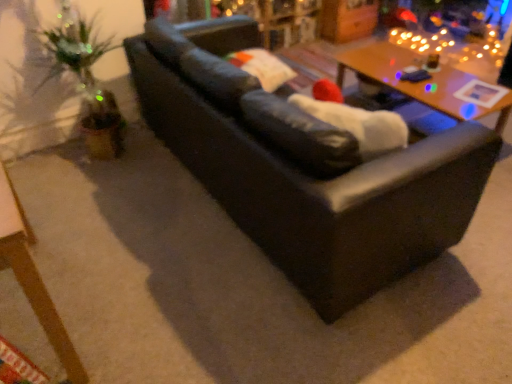
At what (x,y) coordinates should I click in order to perform the action: click on wooden table at upper right, arranged as the first table when viewed from the right. Please return your answer as a coordinate pair (x, y). This screenshot has width=512, height=384. Looking at the image, I should click on (420, 82).

In order to face wooden table at upper right, which is the first table from back to front, should I rotate leftwards or rightwards?

To face it directly, rotate right by 20.216 degrees.

What do you see at coordinates (304, 168) in the screenshot?
I see `matte black couch at center` at bounding box center [304, 168].

Find the location of a particular element. wooden table at lower left, the first table in the left-to-right sequence is located at coordinates (33, 277).

Considering the sizes of objects matte black couch at center and wooden table at upper right, which is the first table from back to front, in the image provided, who is smaller, matte black couch at center or wooden table at upper right, which is the first table from back to front,?

wooden table at upper right, which is the first table from back to front, is smaller.

Between matte black couch at center and wooden table at upper right, arranged as the first table when viewed from the right, which one appears on the left side from the viewer's perspective?

matte black couch at center.

Which of these two, matte black couch at center or wooden table at upper right, arranged as the first table when viewed from the right, stands taller?

matte black couch at center.

Which of these two, matte black couch at center or wooden table at upper right, which is the first table from back to front, is wider?

matte black couch at center.

Based on the photo, could wooden table at lower left, the 2th table in the right-to-left sequence, be considered to be inside matte black couch at center?

No, wooden table at lower left, the 2th table in the right-to-left sequence, is not a part of matte black couch at center.

Measure the distance between matte black couch at center and wooden table at lower left, the 2th table in the right-to-left sequence.

matte black couch at center and wooden table at lower left, the 2th table in the right-to-left sequence, are 1.01 meters apart from each other.

Are matte black couch at center and wooden table at lower left, the 2th table in the right-to-left sequence, beside each other?

There is a gap between matte black couch at center and wooden table at lower left, the 2th table in the right-to-left sequence.

Does point (441, 159) come farther from viewer compared to point (23, 232)?

Yes, it is behind point (23, 232).

Does point (397, 64) lie behind point (26, 264)?

Yes.

Is wooden table at upper right, arranged as the first table when viewed from the right, shorter than wooden table at lower left, the 1th table positioned from the front?

Correct, wooden table at upper right, arranged as the first table when viewed from the right, is not as tall as wooden table at lower left, the 1th table positioned from the front.

Is the position of wooden table at upper right, which is the first table from back to front, more distant than that of wooden table at lower left, the first table in the left-to-right sequence?

Yes, wooden table at upper right, which is the first table from back to front, is further from the camera.

In the scene shown: Which of these two, wooden table at upper right, acting as the second table starting from the left, or wooden table at lower left, the 1th table positioned from the front, is smaller?

With smaller size is wooden table at lower left, the 1th table positioned from the front.

Could matte black couch at center be considered to be inside wooden table at upper right, acting as the second table starting from the left?

No.

From a real-world perspective, which object rests below the other?

wooden table at upper right, acting as the second table starting from the left, from a real-world perspective.

From the image's perspective, is wooden table at upper right, which is the first table from back to front, above or below matte black couch at center?

From the image's perspective, wooden table at upper right, which is the first table from back to front, appears above matte black couch at center.

Does point (352, 58) appear closer or farther from the camera than point (445, 196)?

Point (352, 58) appears to be farther away from the viewer than point (445, 196).

From a real-world perspective, which is physically below, wooden table at lower left, the first table in the left-to-right sequence, or matte black couch at center?

wooden table at lower left, the first table in the left-to-right sequence, is physically lower.

From the image's perspective, which one is positioned lower, wooden table at lower left, the 1th table positioned from the front, or matte black couch at center?

wooden table at lower left, the 1th table positioned from the front.

Does wooden table at lower left, the 1th table positioned from the front, lie behind matte black couch at center?

That is False.

Considering the relative sizes of wooden table at lower left, the first table in the left-to-right sequence, and wooden table at upper right, arranged as the first table when viewed from the right, in the image provided, is wooden table at lower left, the first table in the left-to-right sequence, smaller than wooden table at upper right, arranged as the first table when viewed from the right,?

Yes, wooden table at lower left, the first table in the left-to-right sequence, is smaller than wooden table at upper right, arranged as the first table when viewed from the right.

Is wooden table at lower left, the 1th table positioned from the front, positioned far away from wooden table at upper right, arranged as the first table when viewed from the right?

wooden table at lower left, the 1th table positioned from the front, is far away from wooden table at upper right, arranged as the first table when viewed from the right.

How much distance is there between wooden table at lower left, the 2th table in the right-to-left sequence, and wooden table at upper right, which is the second table from front to back?

A distance of 2.24 meters exists between wooden table at lower left, the 2th table in the right-to-left sequence, and wooden table at upper right, which is the second table from front to back.

Between wooden table at lower left, acting as the second table starting from the back, and wooden table at upper right, which is the first table from back to front, which one has smaller width?

With smaller width is wooden table at lower left, acting as the second table starting from the back.

Find the location of a particular element. Image resolution: width=512 pixels, height=384 pixels. studio couch located in front of the wooden table at upper right, which is the second table from front to back is located at coordinates pyautogui.click(x=304, y=168).

At what (x,y) coordinates should I click in order to perform the action: click on studio couch that is behind the wooden table at lower left, the 1th table positioned from the front. Please return your answer as a coordinate pair (x, y). Looking at the image, I should click on (304, 168).

Based on the photo, considering their positions, is wooden table at upper right, which is the second table from front to back, positioned closer to wooden table at lower left, the first table in the left-to-right sequence, than matte black couch at center?

Among the two, matte black couch at center is located nearer to wooden table at lower left, the first table in the left-to-right sequence.

Estimate the real-world distances between objects in this image. Which object is further from matte black couch at center, wooden table at upper right, acting as the second table starting from the left, or wooden table at lower left, the 1th table positioned from the front?

wooden table at upper right, acting as the second table starting from the left, is positioned further to the anchor matte black couch at center.

Considering their positions, is matte black couch at center positioned further to wooden table at lower left, the first table in the left-to-right sequence, than wooden table at upper right, which is the second table from front to back?

wooden table at upper right, which is the second table from front to back, lies further to wooden table at lower left, the first table in the left-to-right sequence, than the other object.

Considering their positions, is wooden table at lower left, the first table in the left-to-right sequence, positioned closer to matte black couch at center than wooden table at upper right, which is the first table from back to front?

wooden table at lower left, the first table in the left-to-right sequence, is positioned closer to the anchor matte black couch at center.

From the image, which object appears to be farther from wooden table at upper right, which is the first table from back to front, wooden table at lower left, the first table in the left-to-right sequence, or matte black couch at center?

wooden table at lower left, the first table in the left-to-right sequence, lies further to wooden table at upper right, which is the first table from back to front, than the other object.

Which object lies further to the anchor point wooden table at upper right, arranged as the first table when viewed from the right, matte black couch at center or wooden table at lower left, the 1th table positioned from the front?

Based on the image, wooden table at lower left, the 1th table positioned from the front, appears to be further to wooden table at upper right, arranged as the first table when viewed from the right.

Locate an element on the screen. This screenshot has height=384, width=512. studio couch located between wooden table at lower left, the 2th table in the right-to-left sequence, and wooden table at upper right, which is the second table from front to back, in the left-right direction is located at coordinates (304, 168).